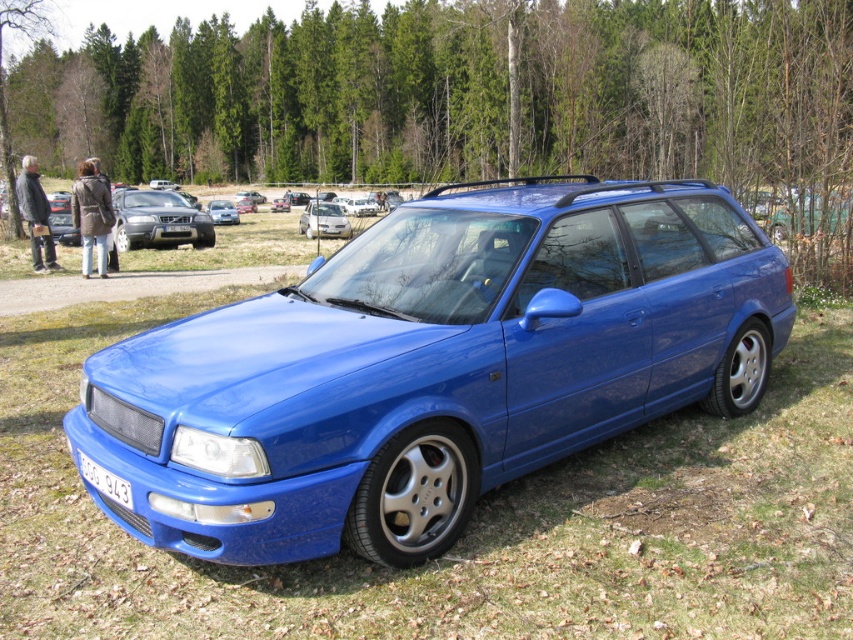
You are a photographer trying to capture the blue metallic hatchback at center in your shot. However, you notice the white plastic license plate at lower center is blocking part of the car. To get a clear view of the entire car, should you move your camera position upwards or downwards?

The white plastic license plate at lower center is located below the blue metallic hatchback at center. To avoid the obstruction, you should move your camera position upwards to frame the blue metallic hatchback at center without the license plate blocking it.

You are standing at the point labeled point (223,200) and want to walk to the blue station wagon parked on the grassy area. Which direction should you move relative to point (90,460)?

To reach the blue station wagon, you should move towards point (90,460), which is in front of point (223,200). Since point (90,460) is in front, moving towards it would lead you toward the car.

You are a photographer trying to capture the white plastic license plate at lower center for a car identification project. You have a camera with a zoom lens that can focus precisely at a specific coordinate point. What coordinate should you aim for to ensure the license plate is in clear focus?

You should aim for the coordinate point at (x=103, y=481) to ensure the white plastic license plate at lower center is in clear focus.